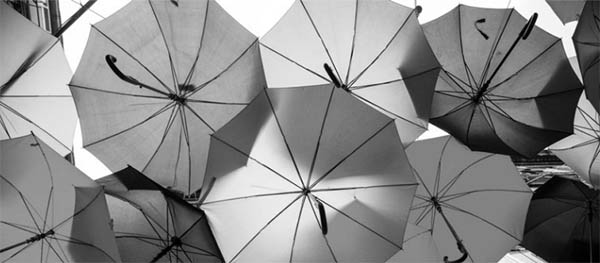
Find the location of a particular element. This screenshot has width=600, height=263. right window pane is located at coordinates (47, 20).